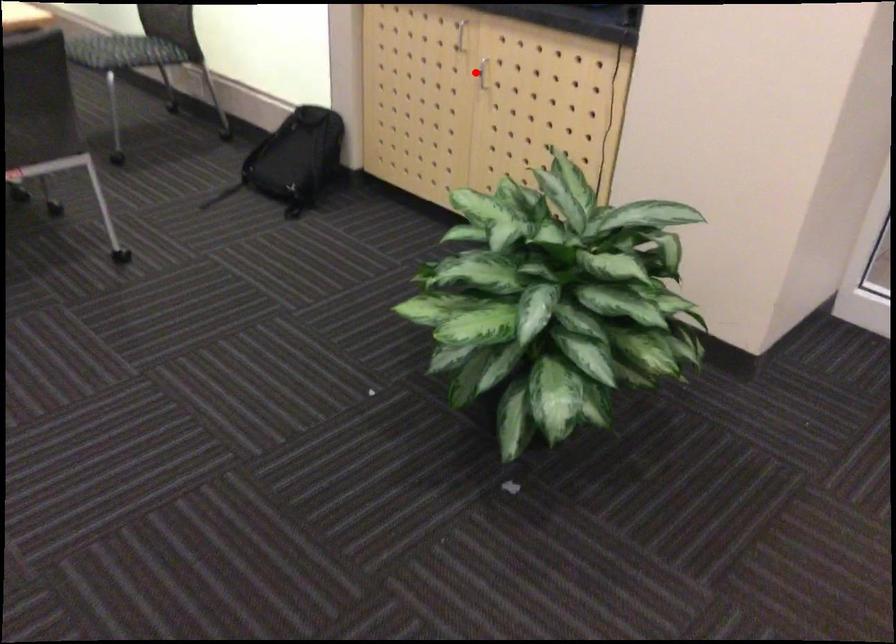
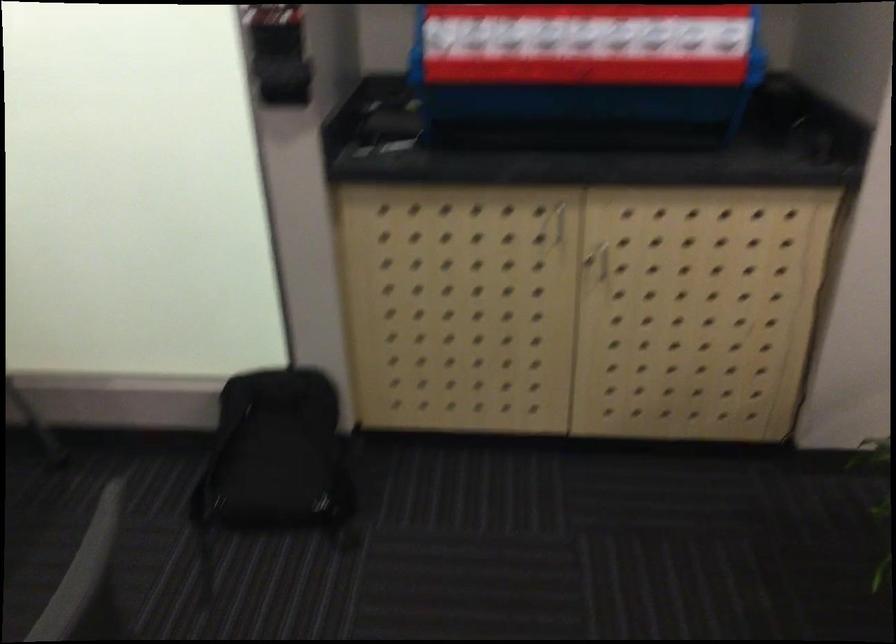
The point at the highlighted location is marked in the first image. Where is the corresponding point in the second image?

(604, 261)